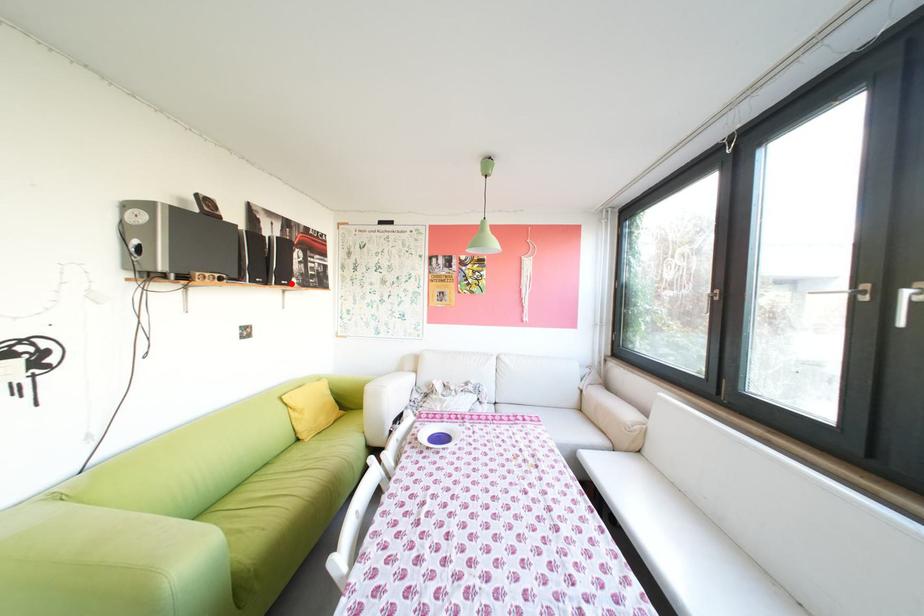
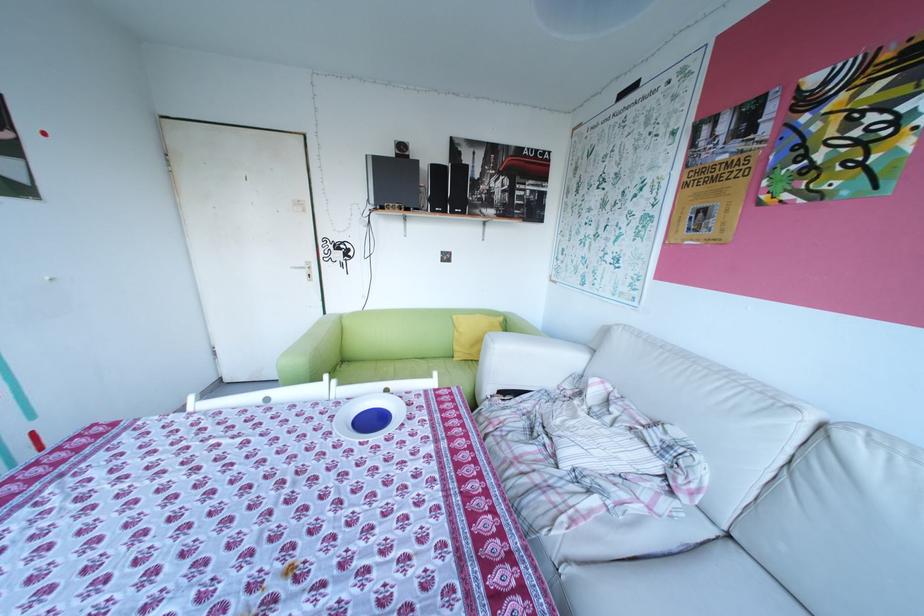
Where in the second image is the point corresponding to the highlighted location from the first image?

(466, 212)